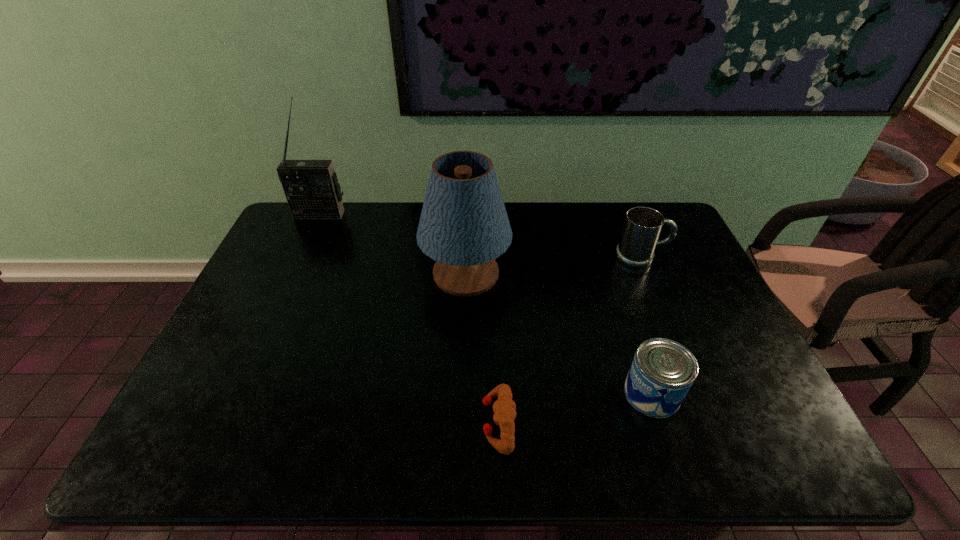
Identify the location of vacant space at the far edge of the desktop. (570, 234).

What are the coordinates of `vacant space at the near edge` in the screenshot? It's located at (290, 446).

At what (x,y) coordinates should I click in order to perform the action: click on blank space at the left edge of the desktop. Please return your answer as a coordinate pair (x, y). Image resolution: width=960 pixels, height=540 pixels. Looking at the image, I should click on (291, 251).

Locate an element on the screen. Image resolution: width=960 pixels, height=540 pixels. vacant space at the right edge of the desktop is located at coordinates (669, 286).

The height and width of the screenshot is (540, 960). In the image, there is a desktop. What are the coordinates of `vacant space at the far left corner` in the screenshot? It's located at (320, 240).

Image resolution: width=960 pixels, height=540 pixels. In order to click on free point at the far right corner in this screenshot , I will do `click(685, 240)`.

In the image, there is a desktop. Where is `vacant space at the near right corner`? vacant space at the near right corner is located at coordinates (728, 435).

You are a GUI agent. You are given a task and a screenshot of the screen. Output one action in this format:
    pyautogui.click(x=<x>, y=<y>)
    Task: Click on the empty space that is in between the third tallest object and the puncher
    Image resolution: width=960 pixels, height=540 pixels.
    Given the screenshot: What is the action you would take?
    pyautogui.click(x=570, y=340)

Where is `unoccupied area between the puncher and the mug`? unoccupied area between the puncher and the mug is located at coordinates (570, 340).

Find the location of a particular element. This screenshot has height=540, width=960. empty space between the third shortest object and the puncher is located at coordinates 570,340.